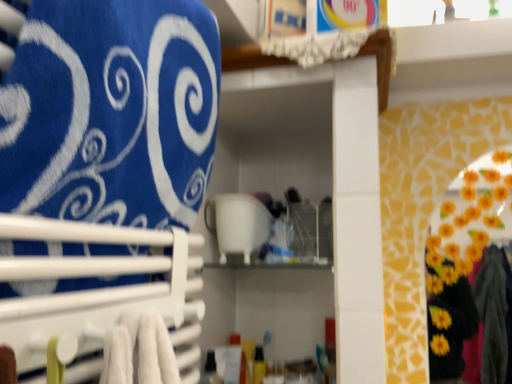
Question: Can you confirm if blue fabric towel at upper left is taller than white plastic towel rack at left?

Choices:
 (A) yes
 (B) no

Answer: (A)

Question: From a real-world perspective, is blue fabric towel at upper left located beneath white plastic towel rack at left?

Choices:
 (A) yes
 (B) no

Answer: (B)

Question: Is blue fabric towel at upper left positioned beyond the bounds of white plastic towel rack at left?

Choices:
 (A) yes
 (B) no

Answer: (A)

Question: From the image's perspective, would you say blue fabric towel at upper left is shown under white plastic towel rack at left?

Choices:
 (A) yes
 (B) no

Answer: (B)

Question: Is blue fabric towel at upper left positioned behind white plastic towel rack at left?

Choices:
 (A) no
 (B) yes

Answer: (B)

Question: In terms of width, does blue fabric towel at upper left look wider or thinner when compared to white plastic towel rack at left?

Choices:
 (A) thin
 (B) wide

Answer: (B)

Question: From the image's perspective, is blue fabric towel at upper left above or below white plastic towel rack at left?

Choices:
 (A) above
 (B) below

Answer: (A)

Question: Relative to white plastic towel rack at left, is blue fabric towel at upper left in front or behind?

Choices:
 (A) front
 (B) behind

Answer: (B)

Question: In terms of size, does blue fabric towel at upper left appear bigger or smaller than white plastic towel rack at left?

Choices:
 (A) small
 (B) big

Answer: (B)

Question: In terms of width, does white plastic towel rack at left look wider or thinner when compared to white glossy cup at center?

Choices:
 (A) thin
 (B) wide

Answer: (A)

Question: Do you think white plastic towel rack at left is within white glossy cup at center, or outside of it?

Choices:
 (A) inside
 (B) outside

Answer: (B)

Question: Is white plastic towel rack at left in front of or behind white glossy cup at center in the image?

Choices:
 (A) front
 (B) behind

Answer: (A)

Question: From a real-world perspective, relative to white glossy cup at center, is white plastic towel rack at left vertically above or below?

Choices:
 (A) below
 (B) above

Answer: (A)

Question: From the image's perspective, is blue fabric towel at upper left positioned above or below white glossy cup at center?

Choices:
 (A) below
 (B) above

Answer: (B)

Question: From a real-world perspective, is blue fabric towel at upper left physically located above or below white glossy cup at center?

Choices:
 (A) above
 (B) below

Answer: (A)